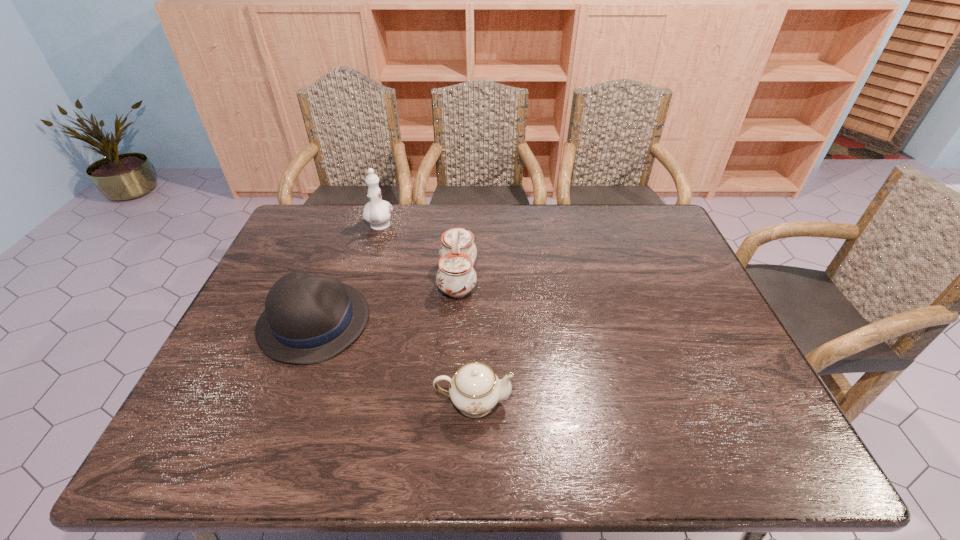
Find the location of a particular element. vacant area that lies between the shortest chinaware and the bowler hat is located at coordinates (394, 362).

Identify the location of free spot between the bowler hat and the shortest object. This screenshot has width=960, height=540. (394, 362).

Identify the location of vacant area that lies between the second shortest object and the leftmost chinaware. (347, 274).

Locate an element on the screen. vacant space that is in between the shortest object and the third tallest object is located at coordinates (394, 362).

The width and height of the screenshot is (960, 540). Identify the location of blank region between the third tallest object and the second farthest chinaware. (386, 300).

At what (x,y) coordinates should I click in order to perform the action: click on free spot between the second farthest chinaware and the farthest chinaware. Please return your answer as a coordinate pair (x, y). Looking at the image, I should click on (419, 253).

This screenshot has width=960, height=540. I want to click on empty space that is in between the farthest chinaware and the shortest chinaware, so click(x=426, y=314).

Select which object appears as the second closest to the bowler hat. Please provide its 2D coordinates. Your answer should be formatted as a tuple, i.e. [(x, y)], where the tuple contains the x and y coordinates of a point satisfying the conditions above.

[(475, 389)]

Identify which object is the third nearest to the second nearest chinaware. Please provide its 2D coordinates. Your answer should be formatted as a tuple, i.e. [(x, y)], where the tuple contains the x and y coordinates of a point satisfying the conditions above.

[(475, 389)]

Point out which chinaware is positioned as the third nearest to the bowler hat. Please provide its 2D coordinates. Your answer should be formatted as a tuple, i.e. [(x, y)], where the tuple contains the x and y coordinates of a point satisfying the conditions above.

[(377, 212)]